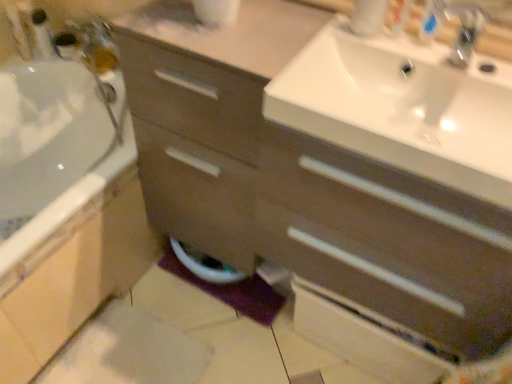
Question: Does metallic silver faucet at upper left, the 2th toiletry in the right-to-left sequence, contain purple fabric bath mat at lower center?

Choices:
 (A) yes
 (B) no

Answer: (B)

Question: Does metallic silver faucet at upper left, acting as the first toiletry starting from the left, turn towards purple fabric bath mat at lower center?

Choices:
 (A) yes
 (B) no

Answer: (B)

Question: Considering the relative positions of metallic silver faucet at upper left, the 2th toiletry in the right-to-left sequence, and purple fabric bath mat at lower center in the image provided, is metallic silver faucet at upper left, the 2th toiletry in the right-to-left sequence, to the left of purple fabric bath mat at lower center from the viewer's perspective?

Choices:
 (A) yes
 (B) no

Answer: (A)

Question: Is the depth of metallic silver faucet at upper left, acting as the first toiletry starting from the left, less than that of purple fabric bath mat at lower center?

Choices:
 (A) yes
 (B) no

Answer: (B)

Question: Is metallic silver faucet at upper left, arranged as the first toiletry when viewed from the back, far from purple fabric bath mat at lower center?

Choices:
 (A) no
 (B) yes

Answer: (B)

Question: Can you confirm if metallic silver faucet at upper left, arranged as the first toiletry when viewed from the back, is smaller than purple fabric bath mat at lower center?

Choices:
 (A) yes
 (B) no

Answer: (A)

Question: From the image's perspective, is metallic silver faucet at upper left, the 2th toiletry in the right-to-left sequence, beneath white glossy toilet bowl at lower center?

Choices:
 (A) yes
 (B) no

Answer: (B)

Question: Considering the relative sizes of metallic silver faucet at upper left, arranged as the 1th toiletry when viewed from the top, and white glossy toilet bowl at lower center in the image provided, is metallic silver faucet at upper left, arranged as the 1th toiletry when viewed from the top, wider than white glossy toilet bowl at lower center?

Choices:
 (A) no
 (B) yes

Answer: (A)

Question: Is metallic silver faucet at upper left, arranged as the 1th toiletry when viewed from the top, not inside white glossy toilet bowl at lower center?

Choices:
 (A) no
 (B) yes

Answer: (B)

Question: From a real-world perspective, does metallic silver faucet at upper left, acting as the first toiletry starting from the left, sit lower than white glossy toilet bowl at lower center?

Choices:
 (A) no
 (B) yes

Answer: (A)

Question: Is the position of metallic silver faucet at upper left, arranged as the first toiletry when viewed from the back, more distant than that of white glossy toilet bowl at lower center?

Choices:
 (A) no
 (B) yes

Answer: (B)

Question: Is metallic silver faucet at upper left, which is the second toiletry in bottom-to-top order, smaller than white glossy toilet bowl at lower center?

Choices:
 (A) yes
 (B) no

Answer: (A)

Question: Can you confirm if purple fabric bath mat at lower center is shorter than white glossy toilet bowl at lower center?

Choices:
 (A) yes
 (B) no

Answer: (A)